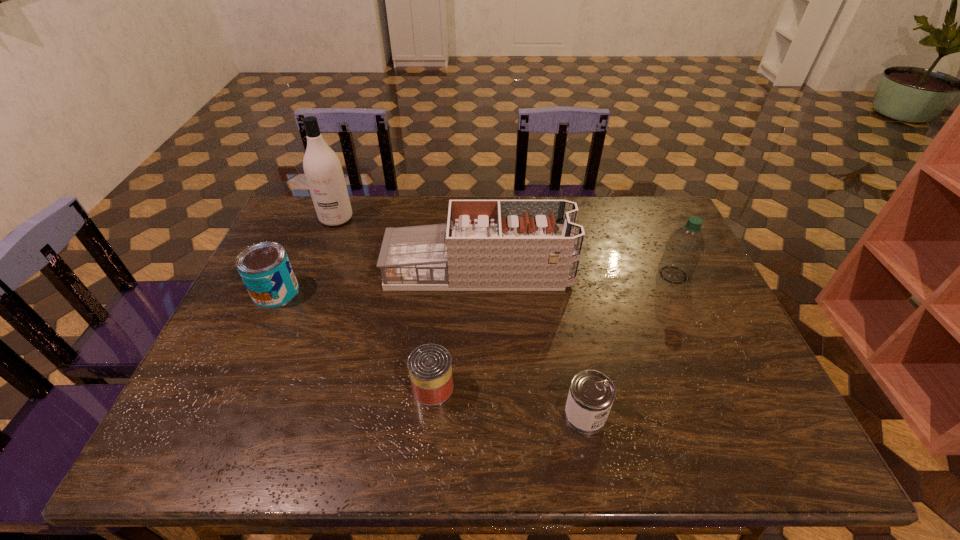
Locate an element on the screen. free space at the near edge is located at coordinates (x=438, y=443).

Where is `vacant position at the left edge of the desktop`? This screenshot has width=960, height=540. vacant position at the left edge of the desktop is located at coordinates (243, 300).

Image resolution: width=960 pixels, height=540 pixels. Identify the location of vacant space at the far right corner. (670, 227).

Locate an element on the screen. The image size is (960, 540). vacant region at the near right corner of the desktop is located at coordinates (724, 437).

In order to click on vacant area that lies between the leftmost can and the tallest object in this screenshot , I will do `click(306, 255)`.

This screenshot has height=540, width=960. In order to click on vacant point located between the rightmost can and the rightmost object in this screenshot , I will do `click(629, 345)`.

I want to click on vacant space in between the tallest object and the second can from left to right, so click(384, 302).

Where is `vacant area that lies between the second can from right to left and the dollhouse`? The image size is (960, 540). vacant area that lies between the second can from right to left and the dollhouse is located at coordinates (456, 329).

What are the coordinates of `free area in between the dollhouse and the leftmost can` in the screenshot? It's located at (377, 281).

Where is `unoccupied position between the second can from left to right and the rightmost can`? unoccupied position between the second can from left to right and the rightmost can is located at coordinates (509, 401).